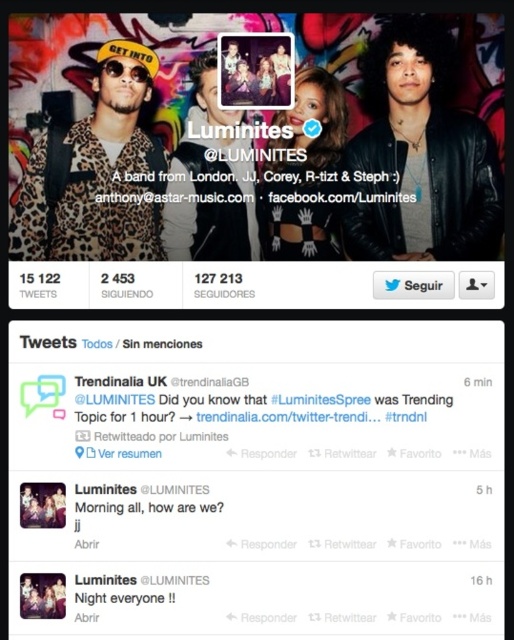
Question: In this image, where is leather jacket at right located relative to leopard print jacket at upper left?

Choices:
 (A) left
 (B) right

Answer: (B)

Question: Does leather jacket at right appear on the left side of matte black top at center?

Choices:
 (A) yes
 (B) no

Answer: (B)

Question: Does matte black top at center come in front of matte black photo frame at upper center?

Choices:
 (A) no
 (B) yes

Answer: (A)

Question: Among these objects, which one is nearest to the camera?

Choices:
 (A) matte black goggles at upper left
 (B) matte black top at center
 (C) leopard print jacket at upper left

Answer: (C)

Question: Which object is the closest to the matte black top at center?

Choices:
 (A) matte black photo frame at upper center
 (B) leopard print jacket at upper left

Answer: (A)

Question: Considering the real-world distances, which object is farthest from the matte black photo frame at upper center?

Choices:
 (A) matte black top at center
 (B) leather jacket at right
 (C) matte black goggles at upper left

Answer: (B)